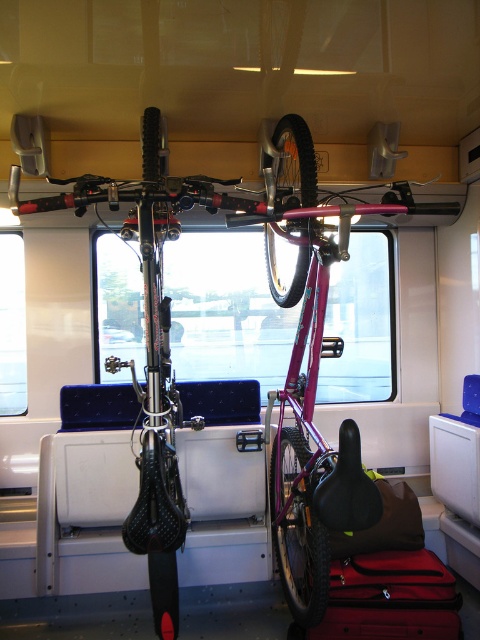
Between matte black bicycle at center and red fabric suitcase at lower center, which one appears on the left side from the viewer's perspective?

matte black bicycle at center

Does matte black bicycle at center appear over red fabric suitcase at lower center?

Yes.

Who is more forward, (180, 513) or (368, 628)?

Point (180, 513) is in front.

Locate an element on the screen. matte black bicycle at center is located at coordinates (169, 323).